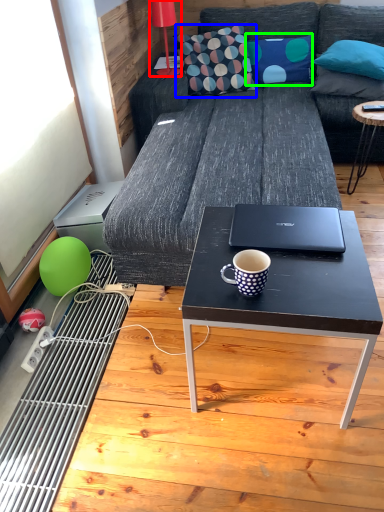
Question: Estimate the real-world distances between objects in this image. Which object is closer to lamp (highlighted by a red box), throw pillow (highlighted by a blue box) or pillow (highlighted by a green box)?

Choices:
 (A) throw pillow
 (B) pillow

Answer: (A)